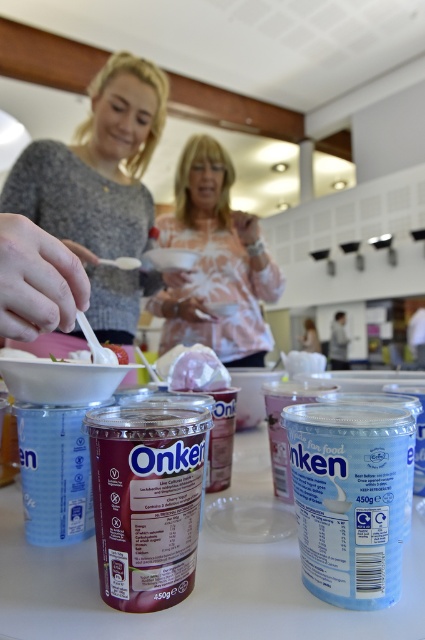
Can you confirm if blue plastic tub at center is positioned to the left of white matte chicken at center?

No, blue plastic tub at center is not to the left of white matte chicken at center.

Does blue plastic tub at center come in front of white matte chicken at center?

Yes, blue plastic tub at center is in front of white matte chicken at center.

Is point (339, 424) positioned after point (180, 385)?

No, it is in front of (180, 385).

Where is `blue plastic tub at center`? The width and height of the screenshot is (425, 640). blue plastic tub at center is located at coordinates (350, 499).

At what (x,y) coordinates should I click in order to perform the action: click on translucent plastic cups at center. Please return your answer as a coordinate pair (x, y). The height and width of the screenshot is (640, 425). Looking at the image, I should click on (197, 582).

Which is more to the right, translucent plastic cups at center or matte gray sweater at upper left?

translucent plastic cups at center is more to the right.

Which is in front, point (70, 637) or point (23, 156)?

Positioned in front is point (70, 637).

What are the coordinates of `translucent plastic cups at center` in the screenshot? It's located at (197, 582).

Does translucent plastic cups at center have a lesser height compared to blue plastic tub at center?

Yes.

Does translucent plastic cups at center appear under blue plastic tub at center?

Correct, translucent plastic cups at center is located below blue plastic tub at center.

Measure the distance between point (326, 637) and camera.

Point (326, 637) and camera are 13.65 inches apart from each other.

Where is `translucent plastic cups at center`? This screenshot has width=425, height=640. translucent plastic cups at center is located at coordinates (197, 582).